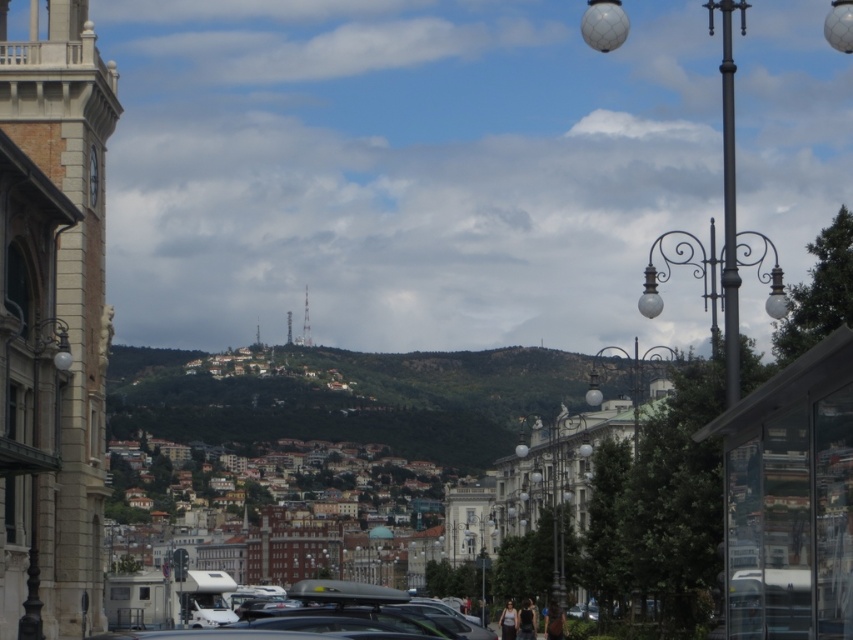
Question: Among these points, which one is farthest from the camera?

Choices:
 (A) (409, 611)
 (B) (309, 333)
 (C) (567, 413)

Answer: (B)

Question: Does matte black car at center appear over metallic silver streetlamp at center?

Choices:
 (A) no
 (B) yes

Answer: (A)

Question: Does green textured hillside at center have a larger size compared to white glass lamp post at right?

Choices:
 (A) yes
 (B) no

Answer: (A)

Question: Among these objects, which one is nearest to the camera?

Choices:
 (A) white metallic tower at center
 (B) polished brass lamp post at center

Answer: (B)

Question: Which object appears closest to the camera in this image?

Choices:
 (A) white glass lamp post at right
 (B) metallic silver bell tower at center

Answer: (A)

Question: Is the position of light beige stone bell tower at left less distant than that of metallic silver bell tower at center?

Choices:
 (A) no
 (B) yes

Answer: (B)